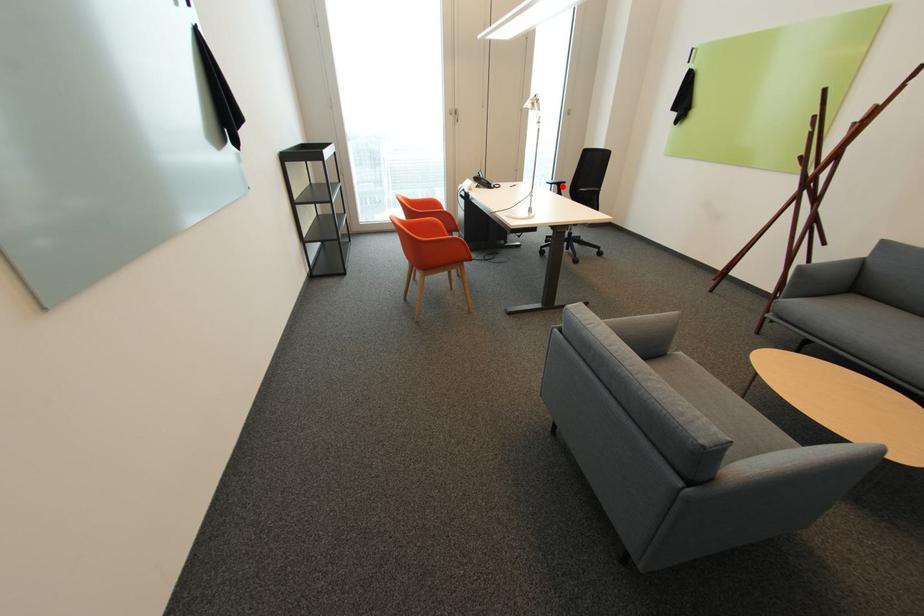
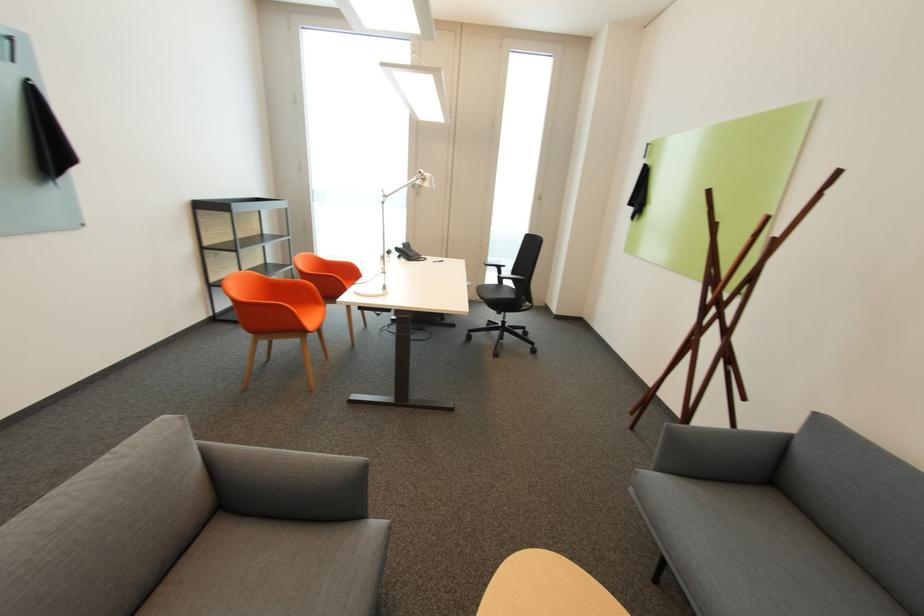
The point at the highlighted location is marked in the first image. Where is the corresponding point in the second image?

(503, 269)